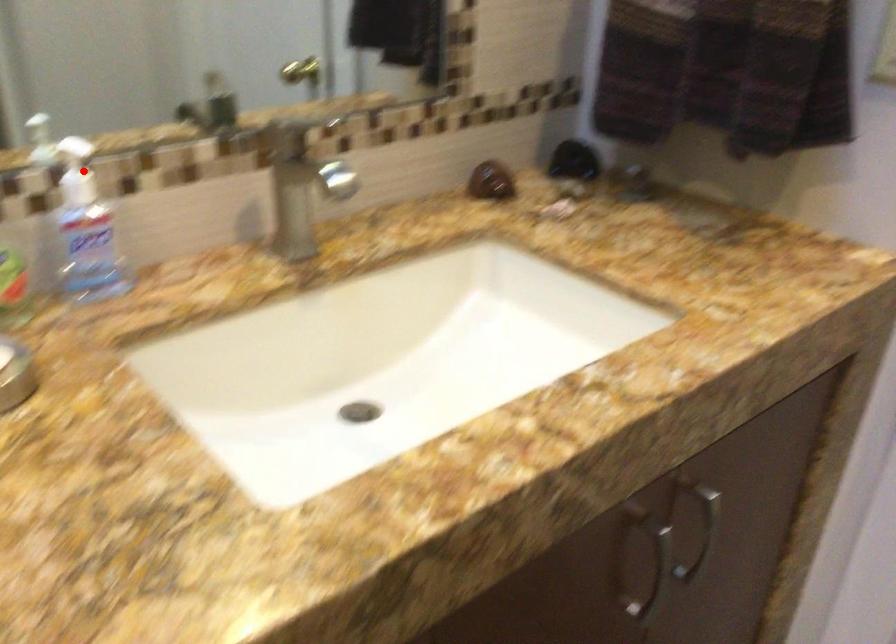
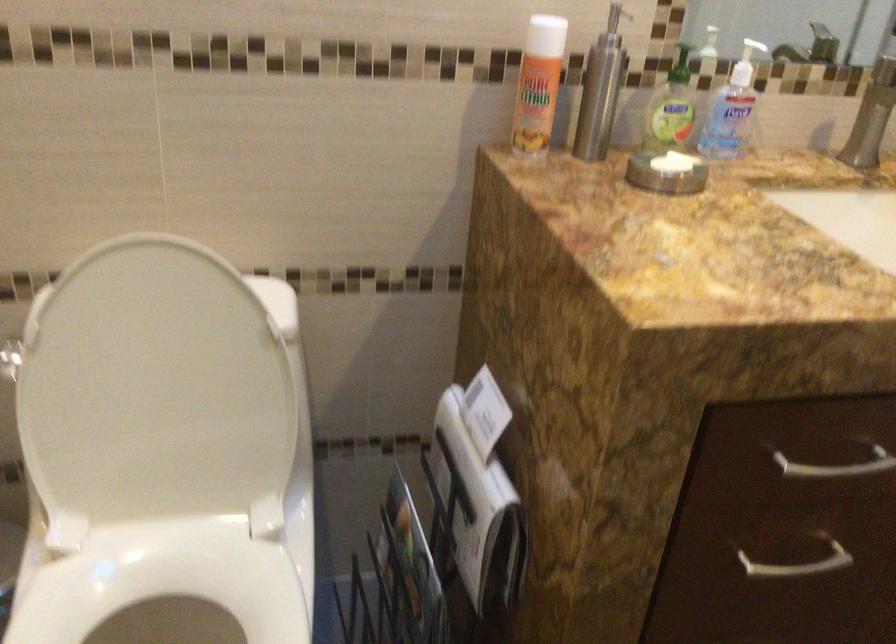
In the second image, find the point that corresponds to the highlighted location in the first image.

(745, 64)